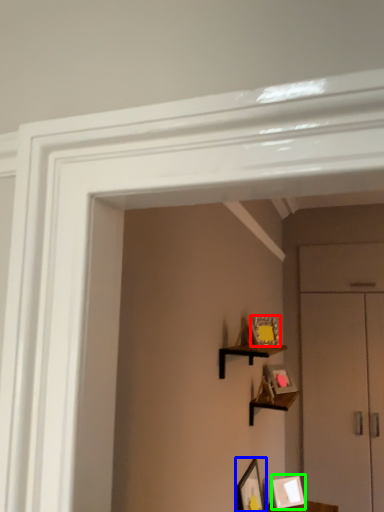
Question: Which object is positioned closest to picture frame (highlighted by a red box)? Select from picture frame (highlighted by a blue box) and picture frame (highlighted by a green box).

Choices:
 (A) picture frame
 (B) picture frame

Answer: (A)